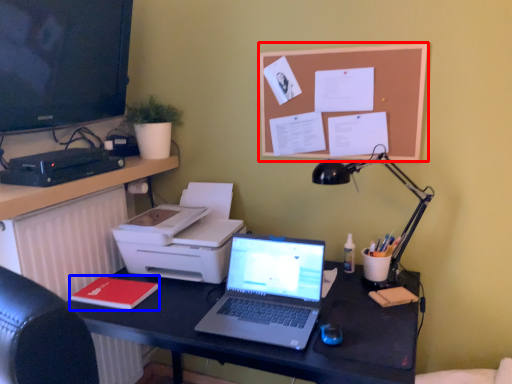
Question: Among these objects, which one is farthest to the camera, bulletin board (highlighted by a red box) or notepad (highlighted by a blue box)?

Choices:
 (A) bulletin board
 (B) notepad

Answer: (A)